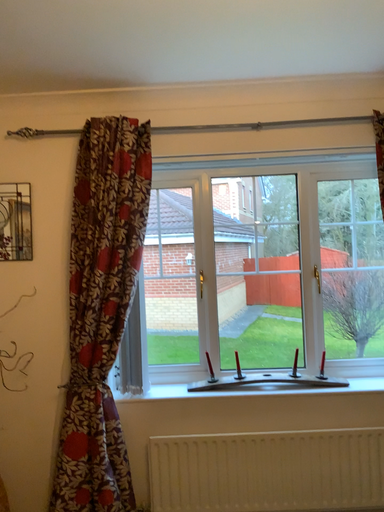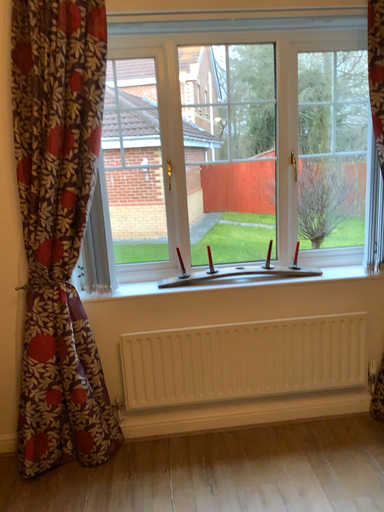
Question: How did the camera likely rotate when shooting the video?

Choices:
 (A) rotated downward
 (B) rotated upward

Answer: (A)